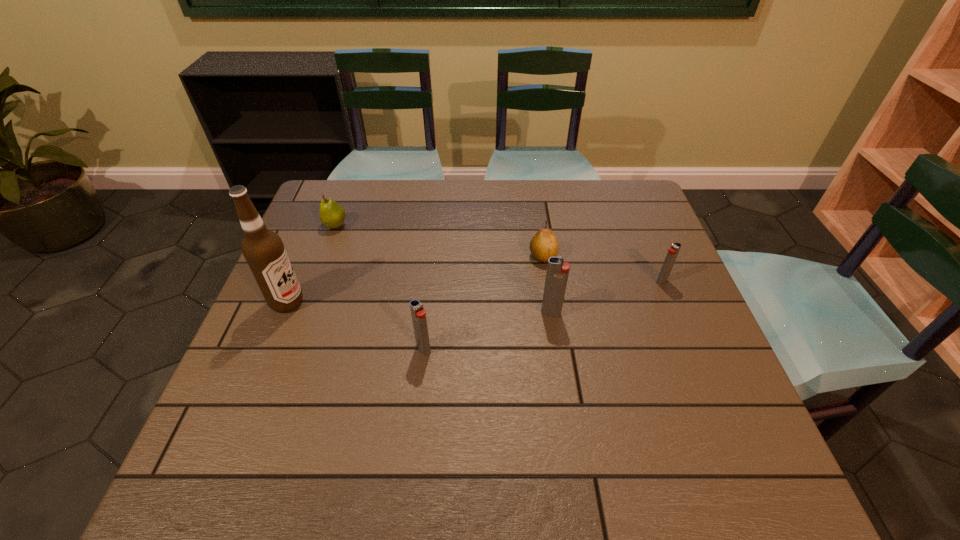
This screenshot has height=540, width=960. Identify the location of blank area in the image that satisfies the following two spatial constraints: 1. on the label of the tallest object; 2. on the right side of the third tallest object. (268, 349).

The width and height of the screenshot is (960, 540). I want to click on blank area in the image that satisfies the following two spatial constraints: 1. on the front side of the third farthest object; 2. on the label of the tallest object, so click(670, 302).

The image size is (960, 540). Find the location of `blank area in the image that satisfies the following two spatial constraints: 1. on the label of the nearest igniter; 2. on the left side of the tallest object`. blank area in the image that satisfies the following two spatial constraints: 1. on the label of the nearest igniter; 2. on the left side of the tallest object is located at coordinates (268, 349).

This screenshot has width=960, height=540. Find the location of `free point that satisfies the following two spatial constraints: 1. on the front side of the rightmost object; 2. on the label of the alcohol`. free point that satisfies the following two spatial constraints: 1. on the front side of the rightmost object; 2. on the label of the alcohol is located at coordinates (670, 302).

This screenshot has width=960, height=540. In order to click on blank space that satisfies the following two spatial constraints: 1. on the front side of the third tallest object; 2. on the left side of the farthest object in this screenshot , I will do `click(289, 349)`.

The image size is (960, 540). I want to click on vacant area that satisfies the following two spatial constraints: 1. on the label of the alcohol; 2. on the back side of the fourth shortest object, so click(268, 349).